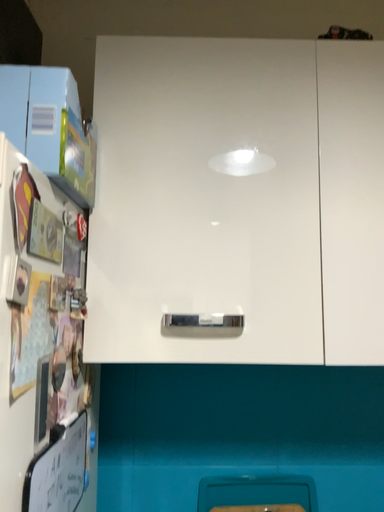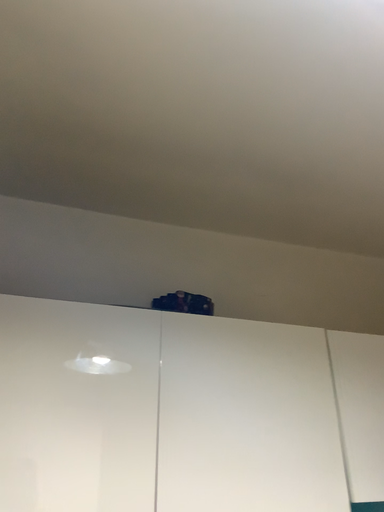
Question: Which way did the camera rotate in the video?

Choices:
 (A) rotated upward
 (B) rotated downward

Answer: (A)